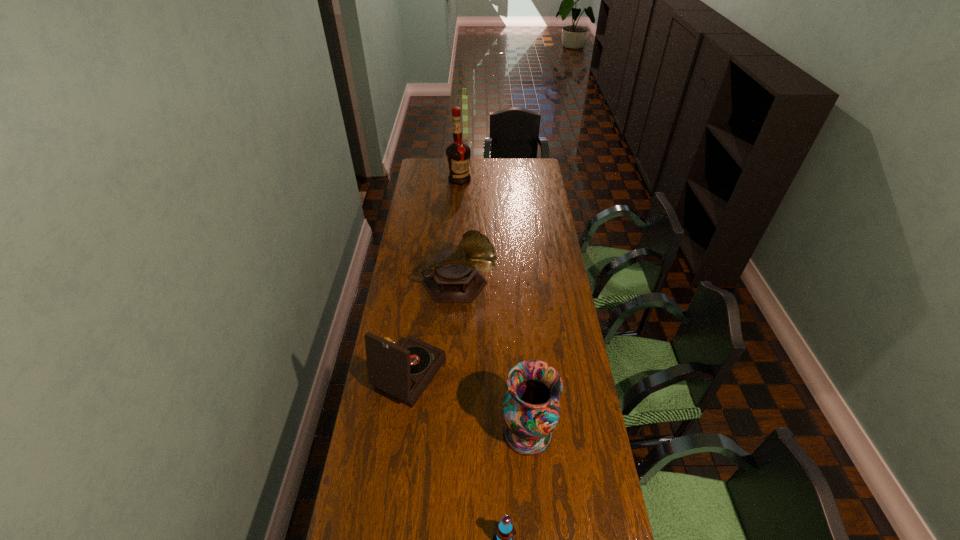
Identify the location of object present at the right edge. (531, 409).

In the image, there is a desktop. Where is `vacant area at the far edge`? vacant area at the far edge is located at coordinates [446, 163].

Where is `vacant space at the left edge`? The width and height of the screenshot is (960, 540). vacant space at the left edge is located at coordinates (426, 243).

You are a GUI agent. You are given a task and a screenshot of the screen. Output one action in this format:
    pyautogui.click(x=<x>, y=<y>)
    Task: Click on the free space at the right edge
    The width and height of the screenshot is (960, 540).
    Given the screenshot: What is the action you would take?
    pyautogui.click(x=575, y=492)

Find the location of a particular element. free space at the far right corner is located at coordinates (522, 175).

Where is `empty location between the nearer phonograph record and the fourth nearest object`? empty location between the nearer phonograph record and the fourth nearest object is located at coordinates (434, 330).

Locate an element on the screen. The height and width of the screenshot is (540, 960). free space between the vase and the second farthest object is located at coordinates (493, 359).

Where is `blank region between the tallest object and the farther phonograph record`? The height and width of the screenshot is (540, 960). blank region between the tallest object and the farther phonograph record is located at coordinates (459, 233).

In order to click on object that is the closest one to the tallest object in this screenshot , I will do [x=454, y=277].

What are the coordinates of `the second closest object relative to the shortest object` in the screenshot? It's located at (403, 372).